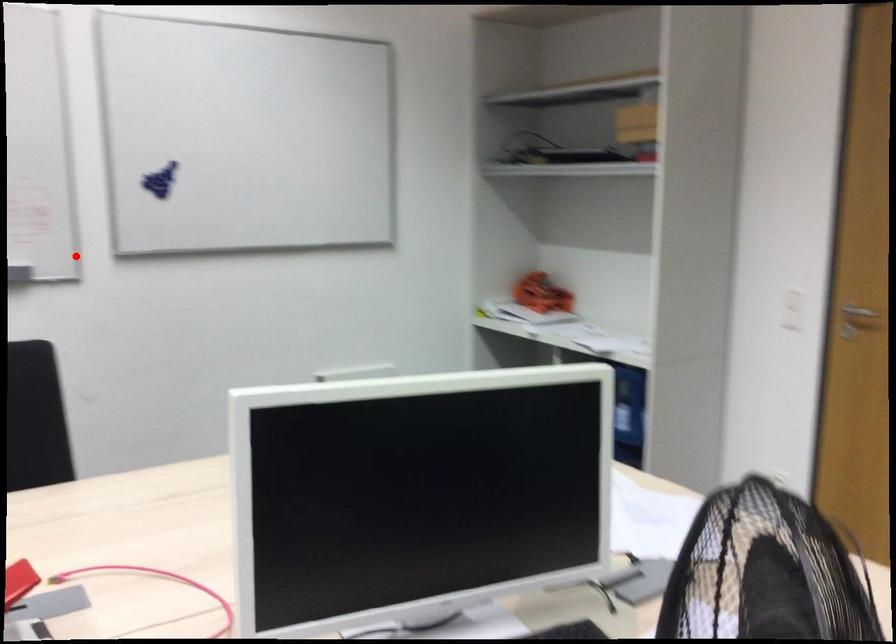
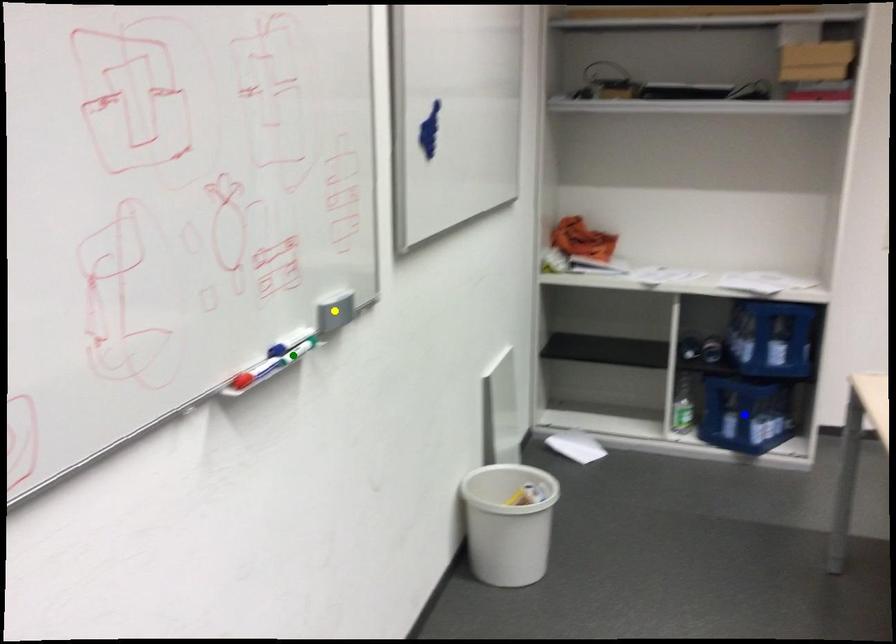
Question: I am providing you with two images of the same scene from different viewpoints. A red point is marked on the first image. You are given multiple points on the second image. Which mark in image 2 goes with the point in image 1?

Choices:
 (A) yellow point
 (B) green point
 (C) blue point

Answer: (A)